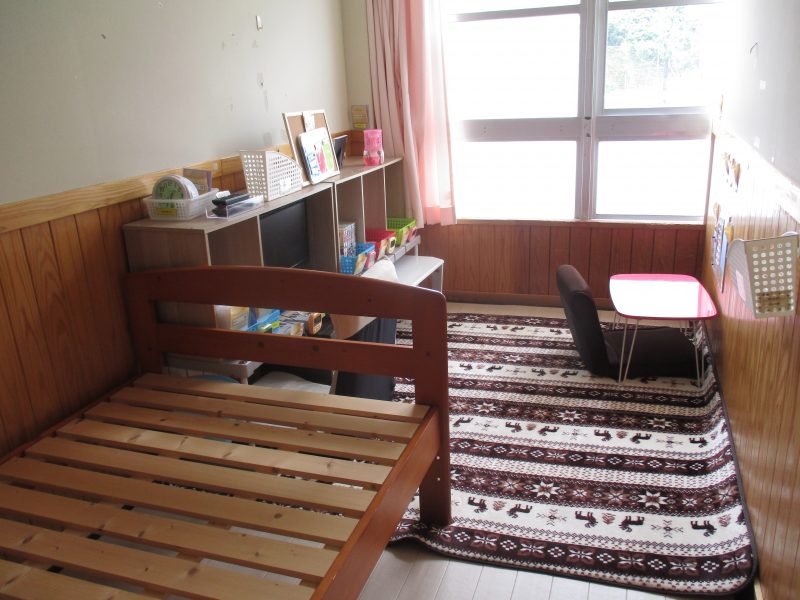
Find the location of `rug`. rug is located at coordinates (577, 494).